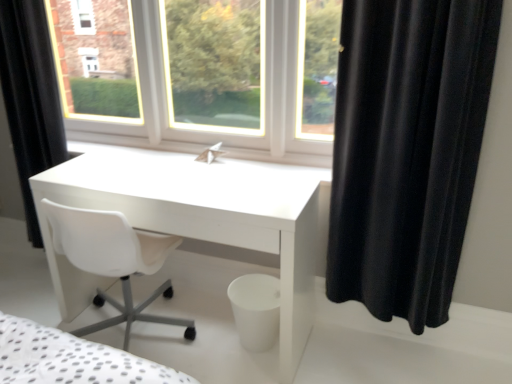
Question: Is white glossy desk at center wider than black matte curtain at left, which ranks as the 2th curtain in right-to-left order?

Choices:
 (A) no
 (B) yes

Answer: (B)

Question: Does white glossy desk at center have a larger size compared to black matte curtain at left, which ranks as the 2th curtain in front-to-back order?

Choices:
 (A) yes
 (B) no

Answer: (A)

Question: From a real-world perspective, is white glossy desk at center over black matte curtain at left, which ranks as the 2th curtain in right-to-left order?

Choices:
 (A) yes
 (B) no

Answer: (B)

Question: Can you confirm if white glossy desk at center is thinner than black matte curtain at left, which ranks as the 2th curtain in right-to-left order?

Choices:
 (A) yes
 (B) no

Answer: (B)

Question: Is white glossy desk at center positioned before black matte curtain at left, which ranks as the 2th curtain in right-to-left order?

Choices:
 (A) yes
 (B) no

Answer: (A)

Question: Is white glossy desk at center taller or shorter than black velvet curtain at right, placed as the 2th curtain when sorted from left to right?

Choices:
 (A) tall
 (B) short

Answer: (B)

Question: Do you think white glossy desk at center is within black velvet curtain at right, marked as the 1th curtain in a front-to-back arrangement, or outside of it?

Choices:
 (A) inside
 (B) outside

Answer: (B)

Question: Based on their positions, is white glossy desk at center located to the left or right of black velvet curtain at right, placed as the 2th curtain when sorted from left to right?

Choices:
 (A) right
 (B) left

Answer: (B)

Question: Considering the positions of white glossy desk at center and black velvet curtain at right, marked as the 1th curtain in a front-to-back arrangement, in the image, is white glossy desk at center bigger or smaller than black velvet curtain at right, marked as the 1th curtain in a front-to-back arrangement,?

Choices:
 (A) small
 (B) big

Answer: (B)

Question: Is black matte curtain at left, which ranks as the 2th curtain in front-to-back order, to the left or to the right of black velvet curtain at right, placed as the 2th curtain when sorted from left to right, in the image?

Choices:
 (A) left
 (B) right

Answer: (A)

Question: Is black matte curtain at left, which ranks as the 2th curtain in front-to-back order, inside the boundaries of black velvet curtain at right, the 1th curtain from the right, or outside?

Choices:
 (A) inside
 (B) outside

Answer: (B)

Question: Is black matte curtain at left, the 1th curtain from the back, in front of or behind black velvet curtain at right, which is counted as the second curtain, starting from the back, in the image?

Choices:
 (A) behind
 (B) front

Answer: (A)

Question: Is point (12, 41) closer or farther from the camera than point (433, 235)?

Choices:
 (A) closer
 (B) farther

Answer: (B)

Question: From the image's perspective, relative to black matte curtain at left, the 1th curtain in the left-to-right sequence, is black velvet curtain at right, marked as the 1th curtain in a front-to-back arrangement, above or below?

Choices:
 (A) above
 (B) below

Answer: (B)

Question: From a real-world perspective, relative to black matte curtain at left, which ranks as the 2th curtain in right-to-left order, is black velvet curtain at right, marked as the 1th curtain in a front-to-back arrangement, vertically above or below?

Choices:
 (A) below
 (B) above

Answer: (A)